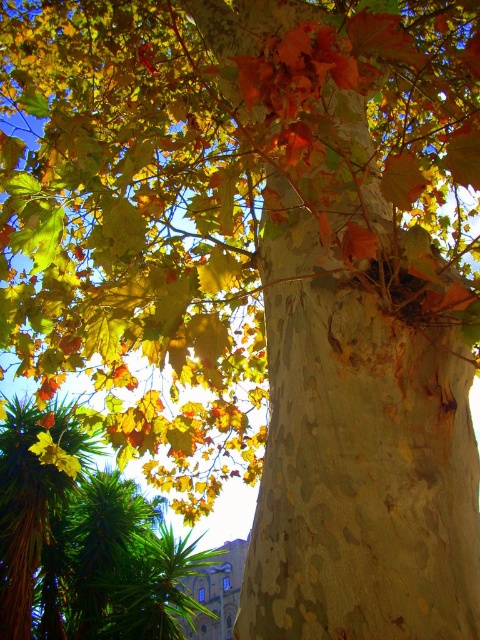
You are standing in front of the tree and want to touch both the green leafy palm at lower left and the green leafy palm at upper left. Which one can you reach first without moving your position?

The green leafy palm at lower left is closer to you, so you can reach it first without moving your position.

You are standing in front of the tree and notice a point on the trunk at coordinates point (94, 556). What is located at that point?

The point (94, 556) corresponds to a green leafy palm at lower left.

You are an artist sketching this tree. You want to draw the green leafy palm at lower left and the green leafy palm at upper left. Which one should you draw wider?

The green leafy palm at lower left should be drawn wider because it has a larger width than the green leafy palm at upper left.